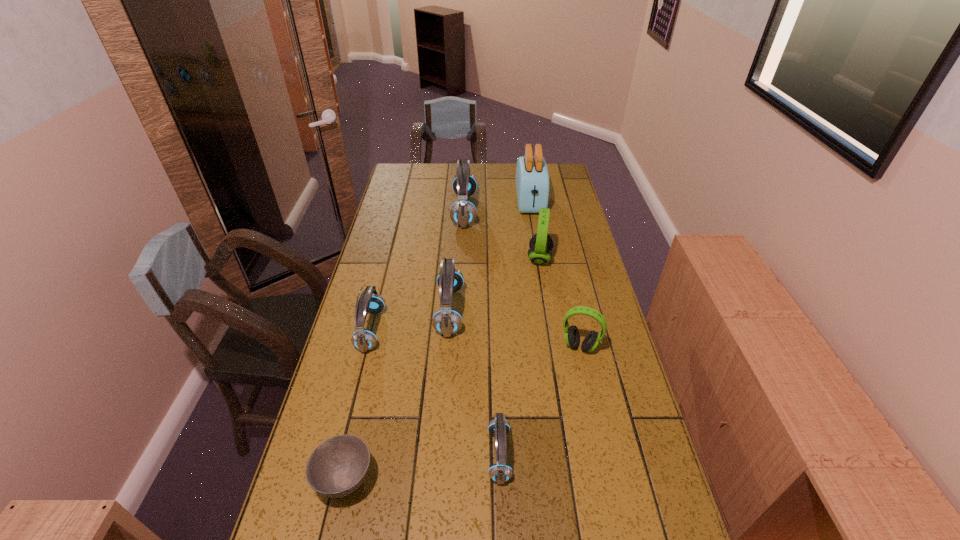
Locate an element on the screen. empty space that is in between the farther green headset and the tallest object is located at coordinates (535, 231).

Where is `unoccupied area between the second farthest headset and the tallest object`? unoccupied area between the second farthest headset and the tallest object is located at coordinates (535, 231).

Locate an element on the screen. The width and height of the screenshot is (960, 540). vacant space in between the leftmost blue headset and the rightmost blue headset is located at coordinates (435, 393).

I want to click on vacant space that is in between the biggest blue headset and the tallest object, so click(497, 206).

Where is `vacant point located between the shortest object and the farthest blue headset`? vacant point located between the shortest object and the farthest blue headset is located at coordinates (405, 345).

You are a GUI agent. You are given a task and a screenshot of the screen. Output one action in this format:
    pyautogui.click(x=<x>, y=<y>)
    Task: Click on the free space between the toaster and the smaller green headset
    The width and height of the screenshot is (960, 540).
    Given the screenshot: What is the action you would take?
    pyautogui.click(x=555, y=274)

At what (x,y) coordinates should I click in order to perform the action: click on free point between the farthest headset and the shortest object. Please return your answer as a coordinate pair (x, y). This screenshot has width=960, height=540. Looking at the image, I should click on (405, 345).

You are a GUI agent. You are given a task and a screenshot of the screen. Output one action in this format:
    pyautogui.click(x=<x>, y=<y>)
    Task: Click on the free space between the third smallest blue headset and the smaller green headset
    
    Given the screenshot: What is the action you would take?
    pyautogui.click(x=515, y=328)

Where is `vacant point located between the leftmost headset and the second biggest blue headset`? vacant point located between the leftmost headset and the second biggest blue headset is located at coordinates (410, 320).

Identify which object is located as the seventh nearest to the second shortest object. Please provide its 2D coordinates. Your answer should be formatted as a tuple, i.e. [(x, y)], where the tuple contains the x and y coordinates of a point satisfying the conditions above.

[(532, 178)]